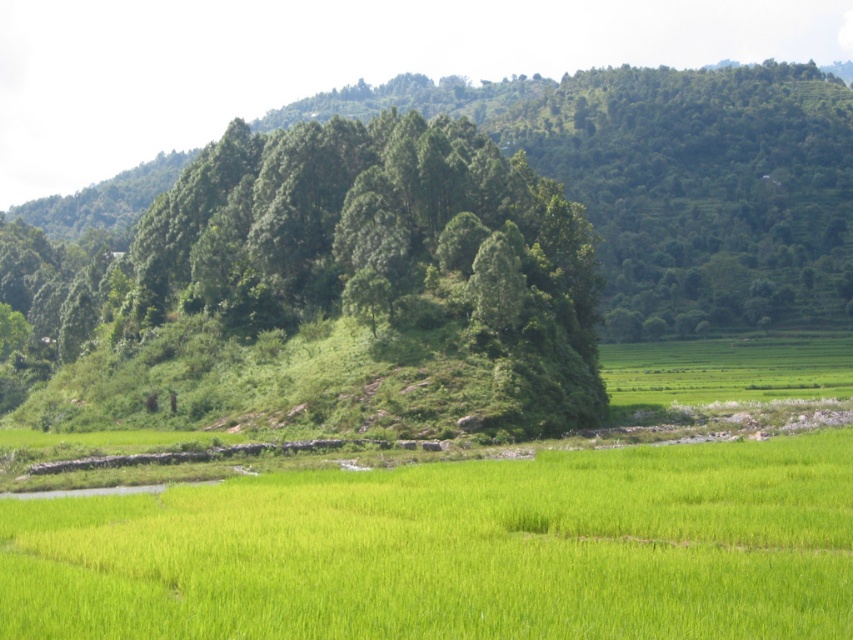
Question: Which object appears closest to the camera in this image?

Choices:
 (A) green leafy tree at center
 (B) green grassy field at center

Answer: (B)

Question: Can you confirm if green leafy tree at center is positioned to the left of green grassy field at center?

Choices:
 (A) no
 (B) yes

Answer: (B)

Question: Which object appears closest to the camera in this image?

Choices:
 (A) green grassy field at center
 (B) green leafy tree at center

Answer: (A)

Question: Does green leafy tree at center appear on the left side of green grassy field at center?

Choices:
 (A) no
 (B) yes

Answer: (B)

Question: Does green leafy tree at center have a larger size compared to green grassy field at center?

Choices:
 (A) no
 (B) yes

Answer: (B)

Question: Among these points, which one is nearest to the camera?

Choices:
 (A) pyautogui.click(x=608, y=600)
 (B) pyautogui.click(x=308, y=180)

Answer: (A)